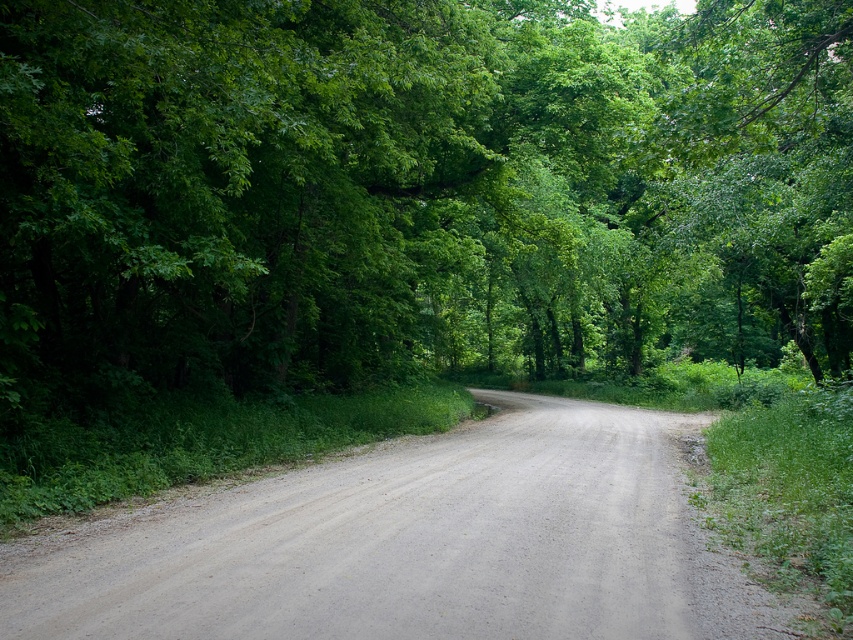
Does green leafy tree at center have a greater height compared to gray gravel road at center?

Indeed, green leafy tree at center has a greater height compared to gray gravel road at center.

Between green leafy tree at center and gray gravel road at center, which one has more height?

Standing taller between the two is green leafy tree at center.

Between point (67, 291) and point (38, 625), which one is positioned in front?

Point (38, 625)

The width and height of the screenshot is (853, 640). Identify the location of green leafy tree at center. (416, 188).